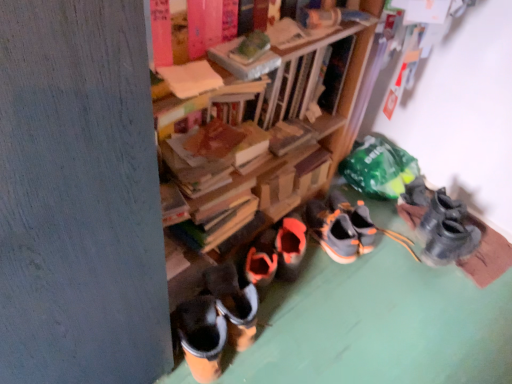
The image size is (512, 384). In order to click on free space to the right of orange suede sneakers at center, positioned as the second footwear in right-to-left order in this screenshot , I will do `click(392, 241)`.